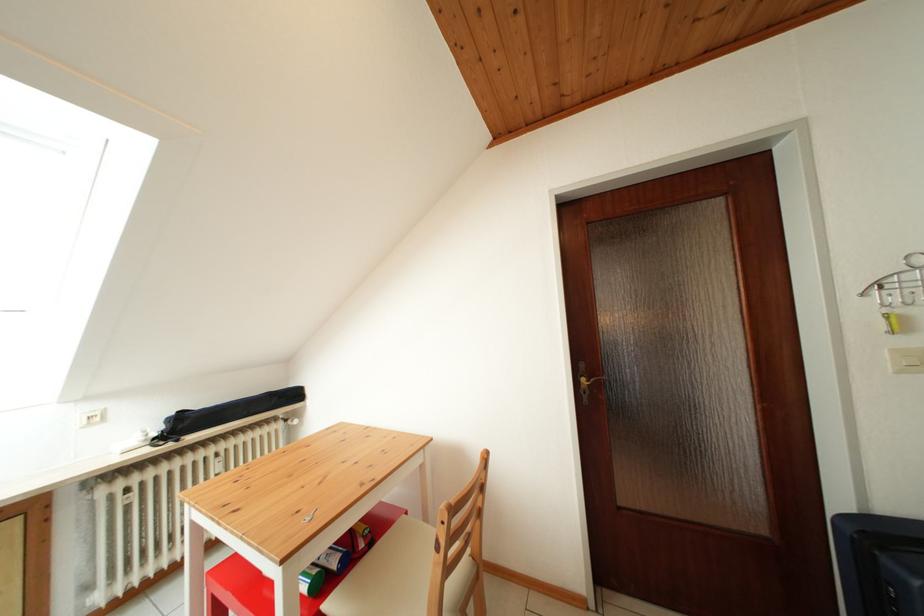
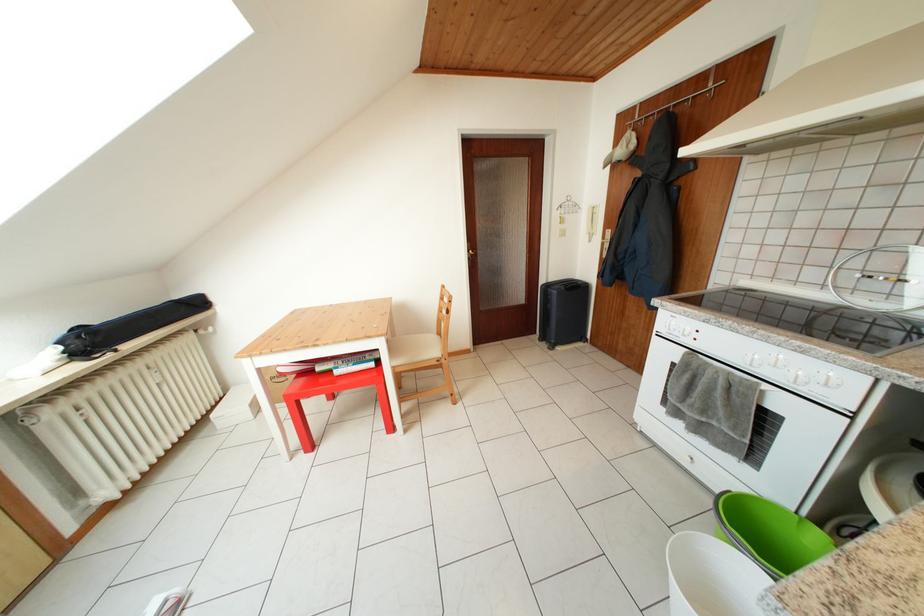
In the second image, find the point that corresponds to the point at 847,506 in the first image.

(551, 286)